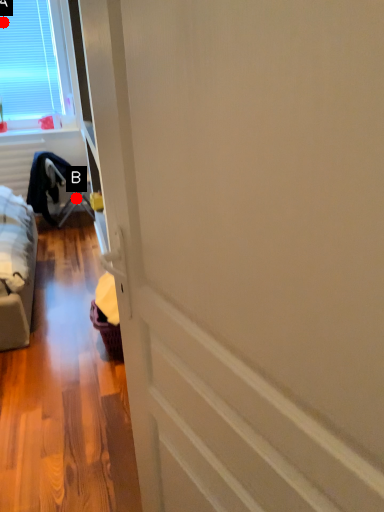
Question: Two points are circled on the image, labeled by A and B beside each circle. Which point appears farthest from the camera in this image?

Choices:
 (A) A is further
 (B) B is further

Answer: (B)